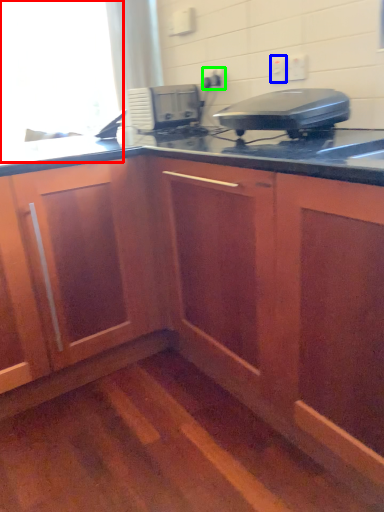
Question: Which object is the farthest from window screen (highlighted by a red box)? Choose among these: electric outlet (highlighted by a blue box) or electric outlet (highlighted by a green box).

Choices:
 (A) electric outlet
 (B) electric outlet

Answer: (A)